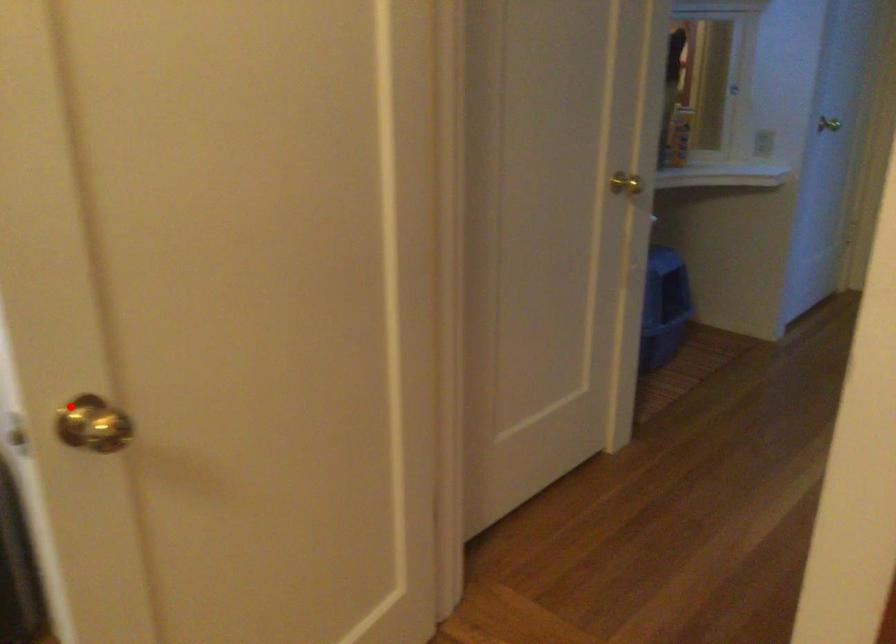
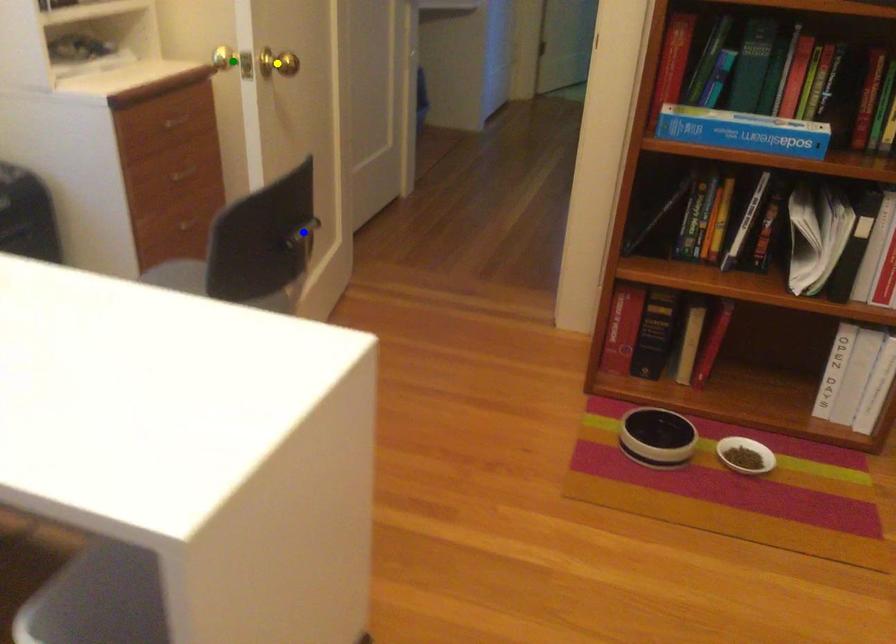
Question: I am providing you with two images of the same scene from different viewpoints. A red point is marked on the first image. You are given multiple points on the second image. Which point in image 2 is actually the same real-world point as the red point in image 1?

Choices:
 (A) yellow point
 (B) blue point
 (C) green point

Answer: (C)